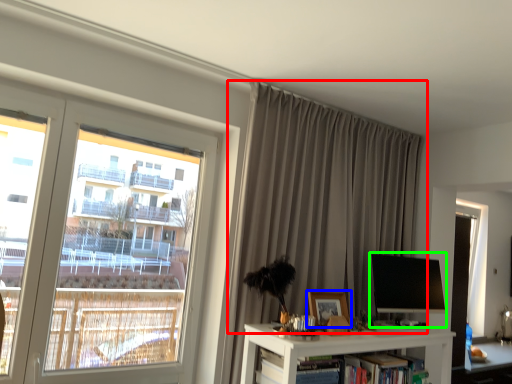
Question: Which is farther away from curtain (highlighted by a red box)? picture frame (highlighted by a blue box) or computer monitor (highlighted by a green box)?

Choices:
 (A) picture frame
 (B) computer monitor

Answer: (A)